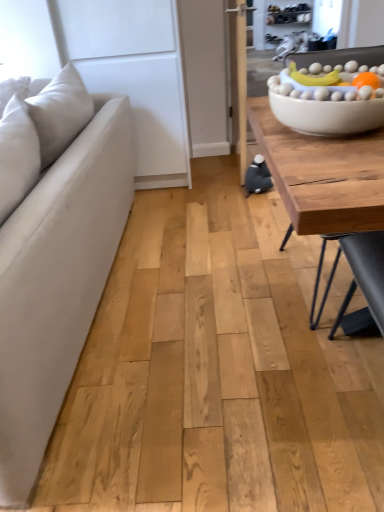
Question: Is white matte bowl at upper right turned away from wooden table at right?

Choices:
 (A) no
 (B) yes

Answer: (B)

Question: Can you confirm if white matte bowl at upper right is bigger than wooden table at right?

Choices:
 (A) no
 (B) yes

Answer: (A)

Question: From the image's perspective, is white matte bowl at upper right on top of wooden table at right?

Choices:
 (A) no
 (B) yes

Answer: (B)

Question: Does white matte bowl at upper right have a lesser width compared to wooden table at right?

Choices:
 (A) yes
 (B) no

Answer: (A)

Question: Does white matte bowl at upper right have a greater width compared to wooden table at right?

Choices:
 (A) yes
 (B) no

Answer: (B)

Question: Are white matte bowl at upper right and wooden table at right far apart?

Choices:
 (A) no
 (B) yes

Answer: (A)

Question: Is wooden table at right smaller than suede beige couch at left?

Choices:
 (A) yes
 (B) no

Answer: (A)

Question: Can you confirm if wooden table at right is wider than suede beige couch at left?

Choices:
 (A) yes
 (B) no

Answer: (A)

Question: Can you confirm if wooden table at right is bigger than suede beige couch at left?

Choices:
 (A) yes
 (B) no

Answer: (B)

Question: From a real-world perspective, is wooden table at right located beneath suede beige couch at left?

Choices:
 (A) no
 (B) yes

Answer: (B)

Question: From a real-world perspective, is wooden table at right on top of suede beige couch at left?

Choices:
 (A) no
 (B) yes

Answer: (A)

Question: Does wooden table at right have a lesser height compared to suede beige couch at left?

Choices:
 (A) yes
 (B) no

Answer: (A)

Question: Does suede beige couch at left turn towards wooden table at right?

Choices:
 (A) no
 (B) yes

Answer: (A)